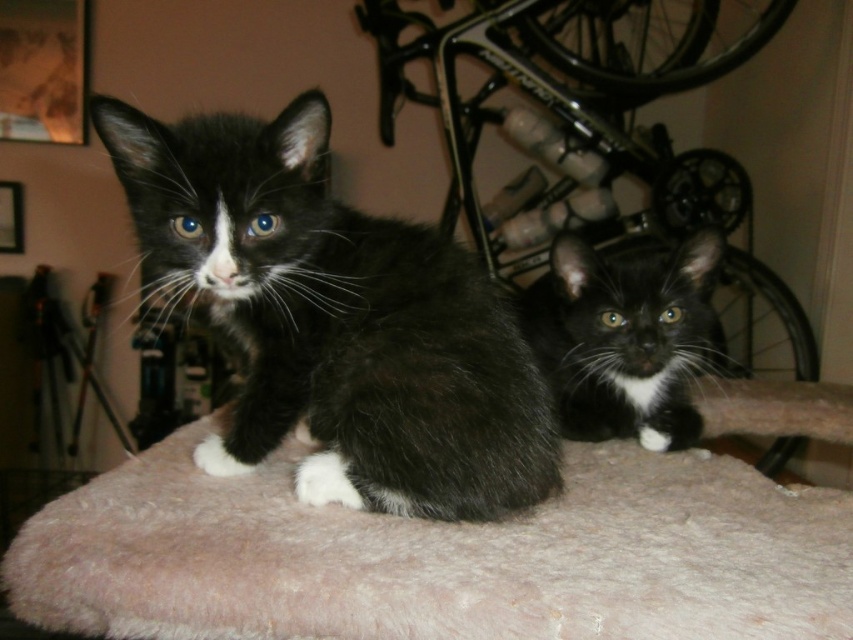
You are taking a photo of two kittens on a light pink surface. There are two points marked on the image at coordinates point (583, 524) and point (616, 420). Which point is nearer to the camera?

Point (583, 524) is closer to the camera than point (616, 420).

You are a cat owner who wants to place a new toy between the fuzzy pink cat bed at center and the black fuzzy cat at center. The toy requires at least 8 inches of space to be placed safely. Can the toy be placed between them?

The distance between the fuzzy pink cat bed at center and the black fuzzy cat at center is 7.80 inches, which is less than the required 8 inches. Therefore, the toy cannot be placed safely between them.

You are trying to determine which cat is wider between the black fuzzy cat at center and the black fur cat at center. Based on the scene description, which one has a greater width?

The black fuzzy cat at center has a greater width than the black fur cat at center.